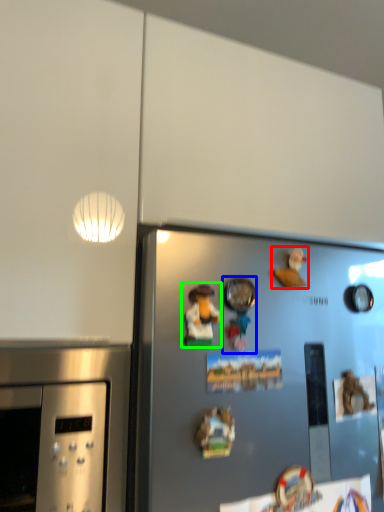
Question: Considering the real-world distances, which object is closest to toy (highlighted by a red box)? toy (highlighted by a blue box) or art (highlighted by a green box).

Choices:
 (A) toy
 (B) art

Answer: (A)